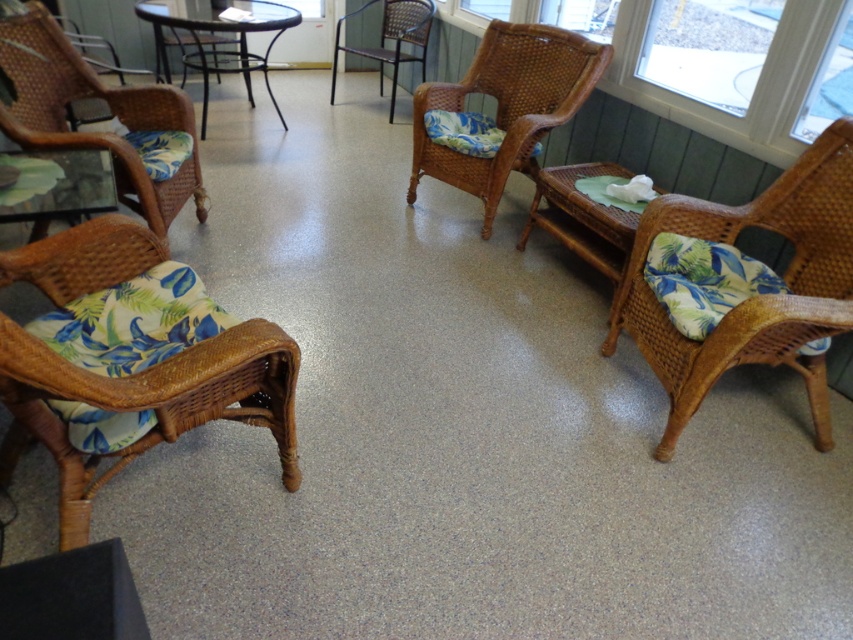
Is point (94, 230) closer to viewer compared to point (68, 196)?

Yes, point (94, 230) is closer to viewer.

Is woven rattan rocking chair at lower left wider than clear glass table at lower left?

Correct, the width of woven rattan rocking chair at lower left exceeds that of clear glass table at lower left.

Who is more forward, (57, 513) or (41, 204)?

Positioned in front is point (57, 513).

I want to click on woven rattan rocking chair at lower left, so click(146, 403).

Is woven wicker armchair at right below clear glass table at lower left?

Yes.

Describe the element at coordinates (753, 298) in the screenshot. I see `woven wicker armchair at right` at that location.

Locate an element on the screen. The image size is (853, 640). woven wicker armchair at right is located at coordinates (753, 298).

Does woven wicker armchair at right appear over black glass table at upper left?

Actually, woven wicker armchair at right is below black glass table at upper left.

Does woven wicker armchair at right have a lesser width compared to black glass table at upper left?

Correct, woven wicker armchair at right's width is less than black glass table at upper left's.

Locate an element on the screen. woven wicker armchair at right is located at coordinates (753, 298).